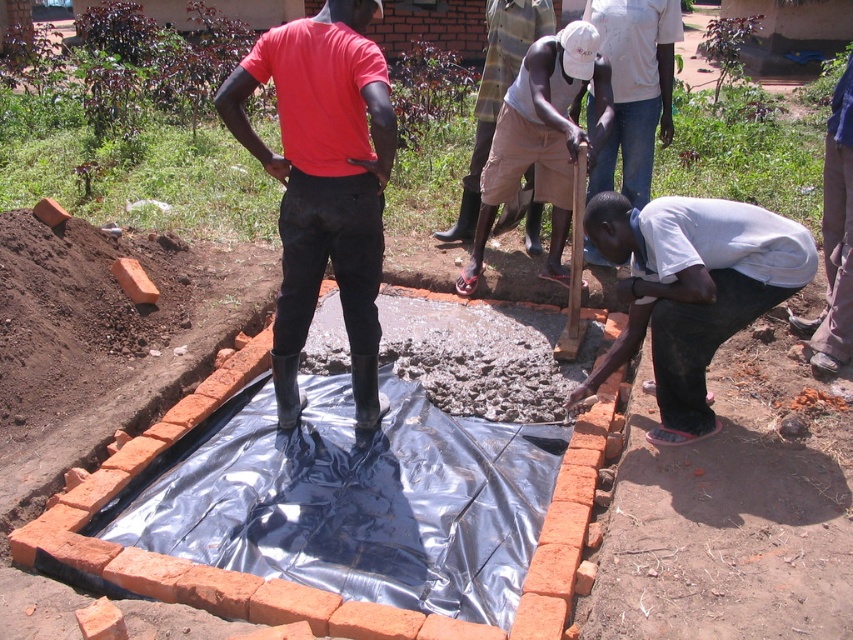
Question: Which point is farther to the camera?

Choices:
 (A) (740, 326)
 (B) (532, 33)
 (C) (527, 84)

Answer: (B)

Question: Is white matte shirt at lower right smaller than gray cotton shirt at lower right?

Choices:
 (A) yes
 (B) no

Answer: (A)

Question: Which point appears closest to the camera in this image?

Choices:
 (A) (474, 212)
 (B) (262, 35)
 (C) (653, 81)

Answer: (C)

Question: Does gray cotton shirt at lower right appear over light brown cotton shorts at center?

Choices:
 (A) no
 (B) yes

Answer: (B)

Question: Is white matte shirt at lower right thinner than gray cotton shirt at lower right?

Choices:
 (A) no
 (B) yes

Answer: (A)

Question: Which of these objects is positioned closest to the white matte shirt at lower right?

Choices:
 (A) gray cotton shirt at lower right
 (B) light brown cotton shorts at center
 (C) light brown shorts at center

Answer: (C)